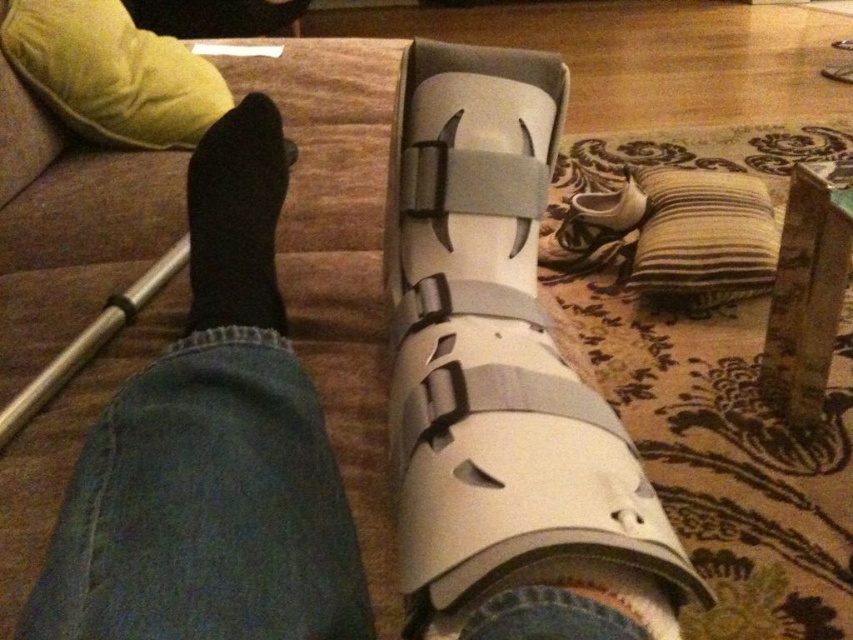
Is point (628, 563) positioned after point (154, 275)?

No.

Which is behind, point (462, 401) or point (169, 260)?

Positioned behind is point (169, 260).

Where is `white matte sock at lower center`? The height and width of the screenshot is (640, 853). white matte sock at lower center is located at coordinates coord(503,381).

Is velvet yellow pillow at upper left closer to camera compared to black sock at left?

No.

Who is more distant from viewer, (224, 100) or (241, 225)?

The point (224, 100) is behind.

At what (x,y) coordinates should I click in order to perform the action: click on velvet yellow pillow at upper left. Please return your answer as a coordinate pair (x, y). Looking at the image, I should click on pos(112,72).

Does black sock at left have a lesser height compared to striped fabric pillow at lower right?

In fact, black sock at left may be taller than striped fabric pillow at lower right.

Between black sock at left and striped fabric pillow at lower right, which one is positioned lower?

black sock at left is lower down.

Describe the element at coordinates (236, 218) in the screenshot. I see `black sock at left` at that location.

Find the location of `black sock at left`. black sock at left is located at coordinates (236, 218).